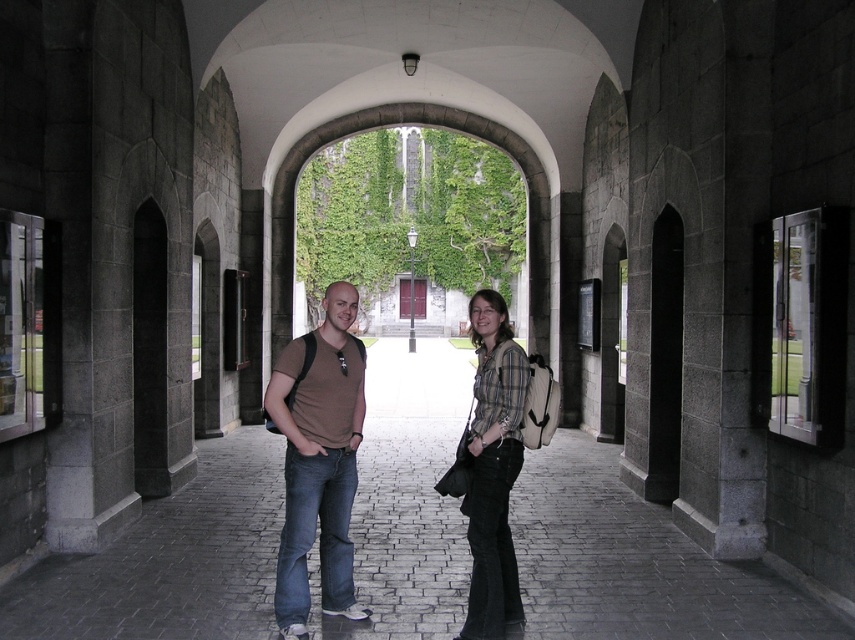
Consider the image. Where is the brown cotton shirt at center located in the image?

The brown cotton shirt at center is located at point (317, 461).